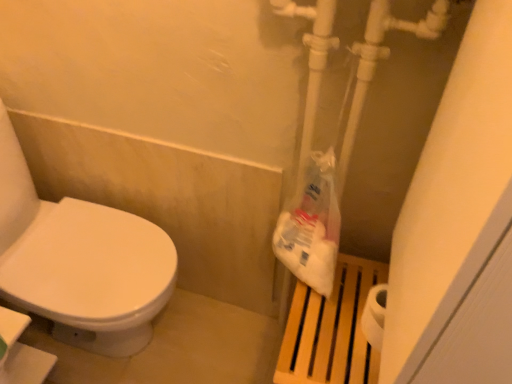
Question: From the image's perspective, is white plastic bag at right located above or below wooden slats at right?

Choices:
 (A) above
 (B) below

Answer: (A)

Question: In terms of width, does white plastic bag at right look wider or thinner when compared to wooden slats at right?

Choices:
 (A) thin
 (B) wide

Answer: (A)

Question: Considering their positions, is white plastic bag at right located in front of or behind wooden slats at right?

Choices:
 (A) behind
 (B) front

Answer: (B)

Question: Considering the positions of point (310, 301) and point (313, 170), is point (310, 301) closer or farther from the camera than point (313, 170)?

Choices:
 (A) closer
 (B) farther

Answer: (B)

Question: Is wooden slats at right to the left or to the right of white plastic bag at right in the image?

Choices:
 (A) left
 (B) right

Answer: (B)

Question: From the image's perspective, relative to white plastic bag at right, is wooden slats at right above or below?

Choices:
 (A) above
 (B) below

Answer: (B)

Question: Is wooden slats at right in front of or behind white plastic bag at right in the image?

Choices:
 (A) front
 (B) behind

Answer: (B)